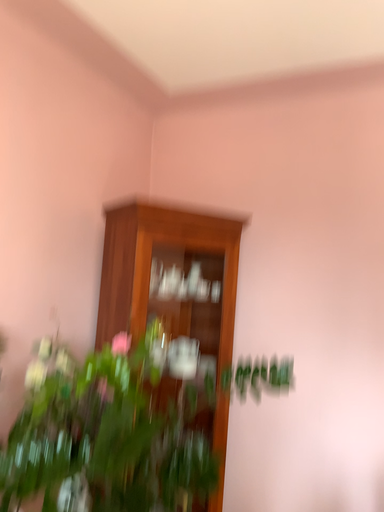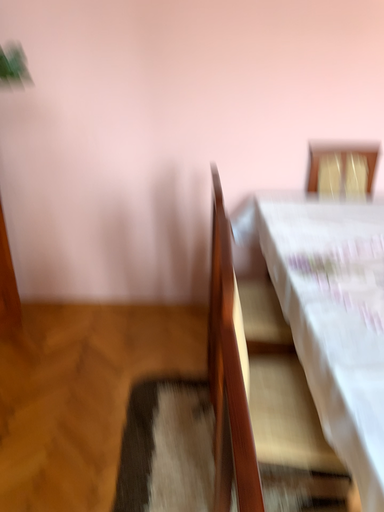
Question: Which way did the camera rotate in the video?

Choices:
 (A) rotated upward
 (B) rotated downward

Answer: (B)